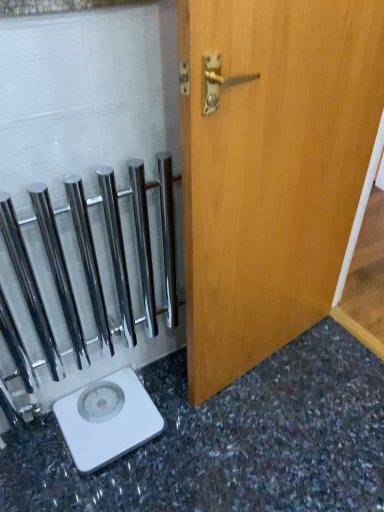
Question: From the image's perspective, would you say granite gray surface at lower left is shown under light brown wood door at center?

Choices:
 (A) no
 (B) yes

Answer: (B)

Question: Does granite gray surface at lower left have a greater width compared to light brown wood door at center?

Choices:
 (A) no
 (B) yes

Answer: (B)

Question: Can you confirm if granite gray surface at lower left is taller than light brown wood door at center?

Choices:
 (A) yes
 (B) no

Answer: (B)

Question: Is the position of granite gray surface at lower left more distant than that of light brown wood door at center?

Choices:
 (A) yes
 (B) no

Answer: (A)

Question: Does granite gray surface at lower left have a lesser width compared to light brown wood door at center?

Choices:
 (A) yes
 (B) no

Answer: (B)

Question: From a real-world perspective, is granite gray surface at lower left over light brown wood door at center?

Choices:
 (A) no
 (B) yes

Answer: (A)

Question: Does light brown wood door at center have a lesser width compared to polished chrome towel bars at left?

Choices:
 (A) no
 (B) yes

Answer: (A)

Question: Is light brown wood door at center at the left side of polished chrome towel bars at left?

Choices:
 (A) no
 (B) yes

Answer: (A)

Question: Are light brown wood door at center and polished chrome towel bars at left beside each other?

Choices:
 (A) no
 (B) yes

Answer: (A)

Question: Does light brown wood door at center have a smaller size compared to polished chrome towel bars at left?

Choices:
 (A) yes
 (B) no

Answer: (B)

Question: Is light brown wood door at center aimed at polished chrome towel bars at left?

Choices:
 (A) yes
 (B) no

Answer: (B)

Question: Is light brown wood door at center far from polished chrome towel bars at left?

Choices:
 (A) no
 (B) yes

Answer: (A)

Question: Is polished chrome towel bars at left outside of light brown wood door at center?

Choices:
 (A) no
 (B) yes

Answer: (B)